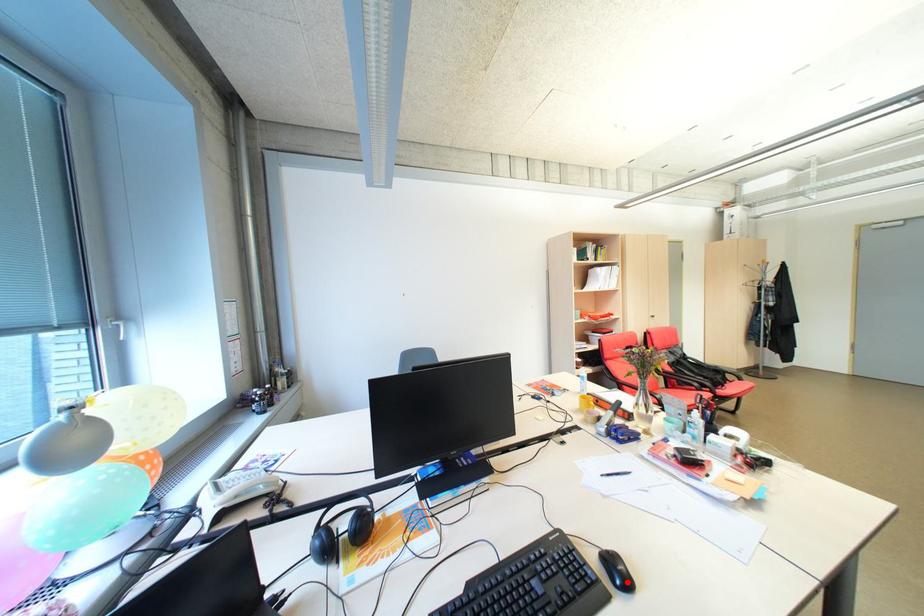
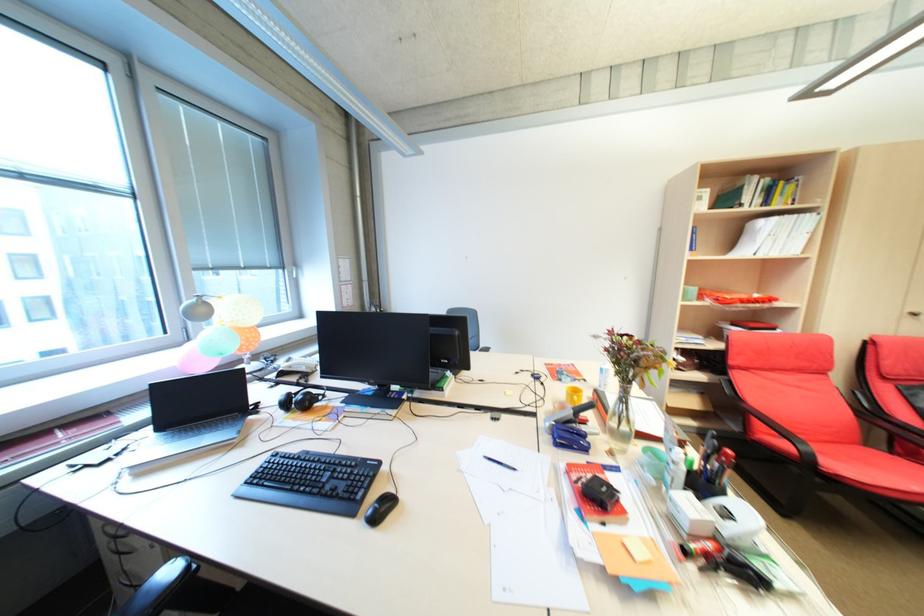
The point at the highlighted location is marked in the first image. Where is the corresponding point in the second image?

(379, 514)